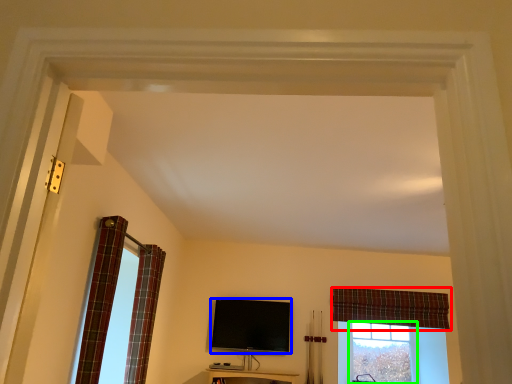
Question: Estimate the real-world distances between objects in this image. Which object is farther from curtain (highlighted by a red box), television (highlighted by a blue box) or bay window (highlighted by a green box)?

Choices:
 (A) television
 (B) bay window

Answer: (A)